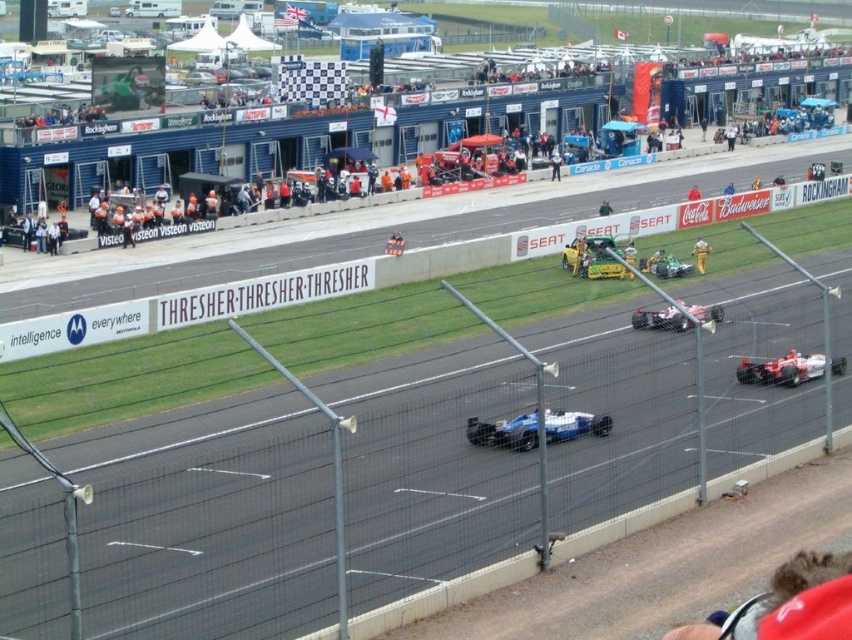
Question: Which of these objects is positioned farthest from the shiny silver race car at center?

Choices:
 (A) red fabric cap at lower right
 (B) shiny red race car at lower right
 (C) yellow-green matte race car at center

Answer: (C)

Question: Is blue metallic race car at center to the left of green matte race car at center from the viewer's perspective?

Choices:
 (A) no
 (B) yes

Answer: (B)

Question: Which of the following is the farthest from the observer?

Choices:
 (A) (551, 424)
 (B) (193, 81)
 (C) (586, 262)

Answer: (B)

Question: Does brown gravel dirt track at center have a greater width compared to khaki fabric pants at center?

Choices:
 (A) no
 (B) yes

Answer: (B)

Question: Estimate the real-world distances between objects in this image. Which object is farther from the shiny silver race car at center?

Choices:
 (A) blue metallic race car at center
 (B) red fabric cap at lower right
 (C) black asphalt race track at center

Answer: (B)

Question: Can you confirm if blue metallic race car at center is positioned below khaki fabric pants at center?

Choices:
 (A) yes
 (B) no

Answer: (A)